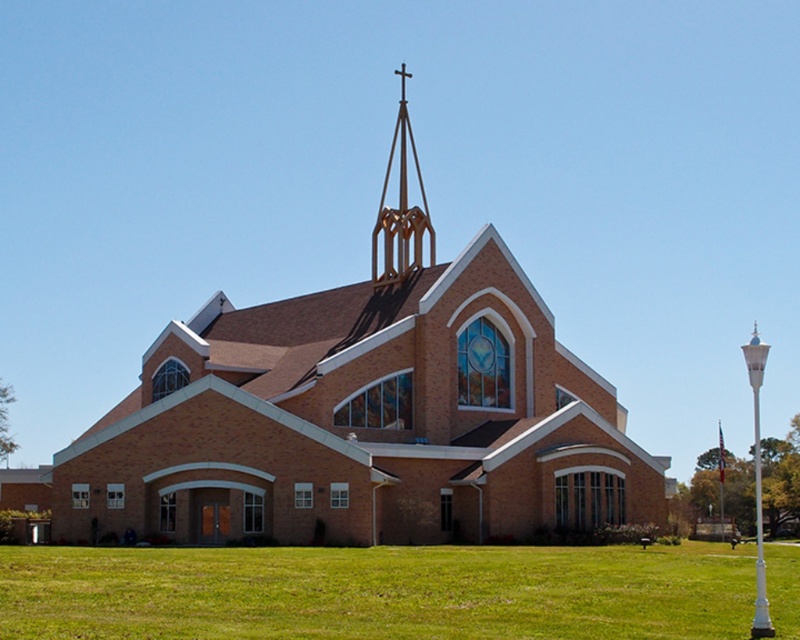
Does brown brick church at center have a lesser width compared to gold metallic spire at upper center?

No.

Which is in front, point (393, 365) or point (394, 253)?

Positioned in front is point (393, 365).

The height and width of the screenshot is (640, 800). In order to click on brown brick church at center in this screenshot , I will do `click(366, 412)`.

Can you confirm if green grass at lower center is bigger than white glossy lamppost at right?

Actually, green grass at lower center might be smaller than white glossy lamppost at right.

Between point (745, 611) and point (760, 618), which one is positioned behind?

Point (745, 611)

Which is in front, point (69, 625) or point (756, 358)?

Point (69, 625) is in front.

What are the coordinates of `green grass at lower center` in the screenshot? It's located at click(376, 593).

Who is higher up, green grass at lower center or gold metallic spire at upper center?

gold metallic spire at upper center is higher up.

Does green grass at lower center appear under gold metallic spire at upper center?

Correct, green grass at lower center is located below gold metallic spire at upper center.

Locate an element on the screen. The width and height of the screenshot is (800, 640). green grass at lower center is located at coordinates (376, 593).